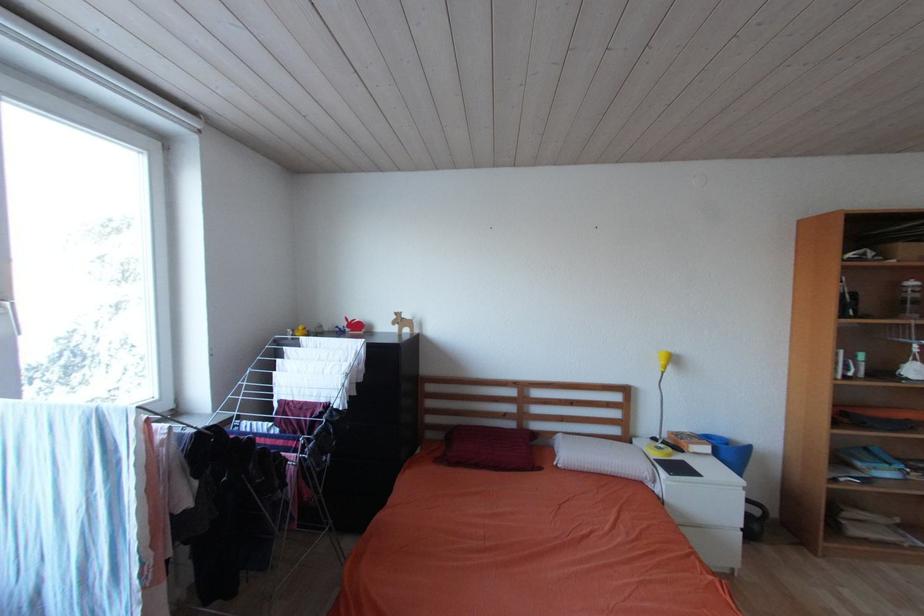
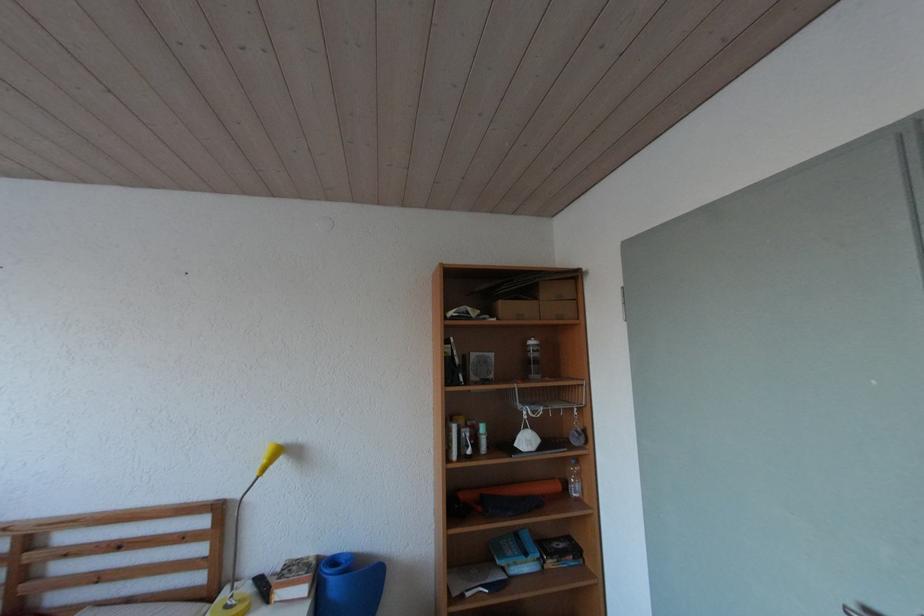
Question: In a continuous first-person perspective shot, in which direction is the camera moving?

Choices:
 (A) Left
 (B) Right
 (C) Forward
 (D) Backward

Answer: (B)